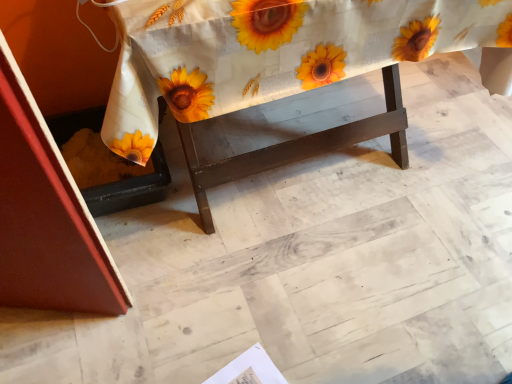
What are the coordinates of `vacant space underneath wooden table at center (from a real-world perspective)` in the screenshot? It's located at (289, 167).